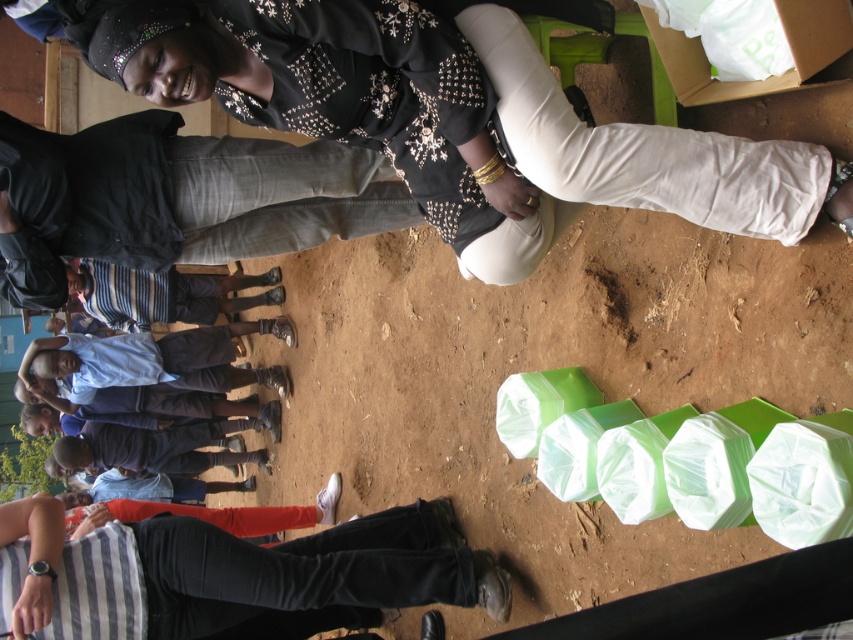
Is black jeans at lower center closer to the viewer compared to blue shirt at lower left?

That is True.

What do you see at coordinates (231, 576) in the screenshot? I see `black jeans at lower center` at bounding box center [231, 576].

Is point (189, 592) positioned in front of point (218, 324)?

Yes, point (189, 592) is in front of point (218, 324).

This screenshot has height=640, width=853. Identify the location of black jeans at lower center. (231, 576).

Can you confirm if matte black blouse at upper center is positioned to the left of blue shirt at lower left?

Incorrect, matte black blouse at upper center is not on the left side of blue shirt at lower left.

Measure the distance between point (717,182) and camera.

Point (717,182) and camera are 6.29 feet apart from each other.

This screenshot has height=640, width=853. In order to click on matte black blouse at upper center in this screenshot , I will do `click(453, 115)`.

Can you confirm if matte black blouse at upper center is positioned to the right of black jeans at lower center?

Yes, matte black blouse at upper center is to the right of black jeans at lower center.

Does point (231, 90) lie behind point (152, 620)?

No, (231, 90) is closer to viewer.

What do you see at coordinates (453, 115) in the screenshot?
I see `matte black blouse at upper center` at bounding box center [453, 115].

Locate an element on the screen. This screenshot has width=853, height=640. matte black blouse at upper center is located at coordinates (453, 115).